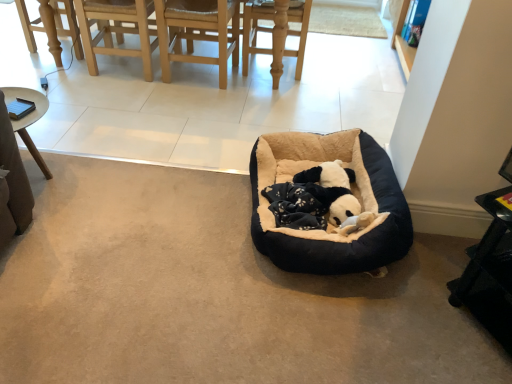
Question: Is black plush dog bed at center far away from black plastic table at lower right?

Choices:
 (A) no
 (B) yes

Answer: (A)

Question: Is black plush dog bed at center to the right of black plastic table at lower right from the viewer's perspective?

Choices:
 (A) yes
 (B) no

Answer: (B)

Question: Would you say black plastic table at lower right is part of black plush dog bed at center's contents?

Choices:
 (A) no
 (B) yes

Answer: (A)

Question: Does black plush dog bed at center appear on the left side of black plastic table at lower right?

Choices:
 (A) yes
 (B) no

Answer: (A)

Question: Does black plush dog bed at center have a larger size compared to black plastic table at lower right?

Choices:
 (A) no
 (B) yes

Answer: (B)

Question: From their relative heights in the image, would you say light wood chair at upper left is taller or shorter than black plastic table at lower right?

Choices:
 (A) tall
 (B) short

Answer: (A)

Question: From a real-world perspective, is light wood chair at upper left above or below black plastic table at lower right?

Choices:
 (A) above
 (B) below

Answer: (A)

Question: Is point (125, 51) positioned closer to the camera than point (474, 294)?

Choices:
 (A) closer
 (B) farther

Answer: (B)

Question: From the image's perspective, is light wood chair at upper left positioned above or below black plastic table at lower right?

Choices:
 (A) below
 (B) above

Answer: (B)

Question: From the image's perspective, is black plastic table at lower right located above or below light wood chair at upper left?

Choices:
 (A) above
 (B) below

Answer: (B)

Question: Considering the relative positions of black plastic table at lower right and light wood chair at upper left in the image provided, is black plastic table at lower right to the left or to the right of light wood chair at upper left?

Choices:
 (A) left
 (B) right

Answer: (B)

Question: Is black plastic table at lower right in front of or behind light wood chair at upper left in the image?

Choices:
 (A) behind
 (B) front

Answer: (B)

Question: From their relative heights in the image, would you say black plastic table at lower right is taller or shorter than light wood chair at upper left?

Choices:
 (A) tall
 (B) short

Answer: (B)

Question: From a real-world perspective, relative to light wood chair at upper left, is black plush dog bed at center vertically above or below?

Choices:
 (A) below
 (B) above

Answer: (A)

Question: From their relative heights in the image, would you say black plush dog bed at center is taller or shorter than light wood chair at upper left?

Choices:
 (A) short
 (B) tall

Answer: (A)